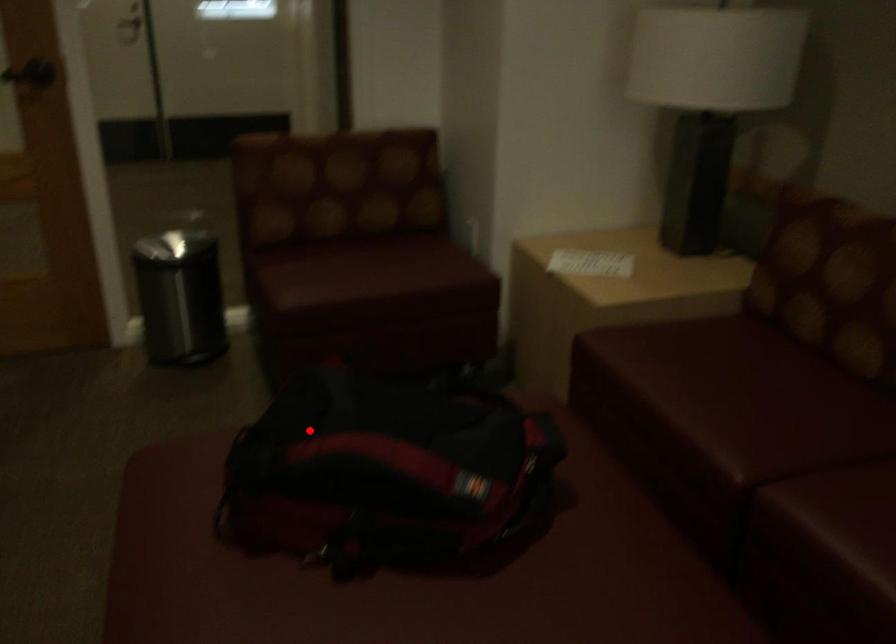
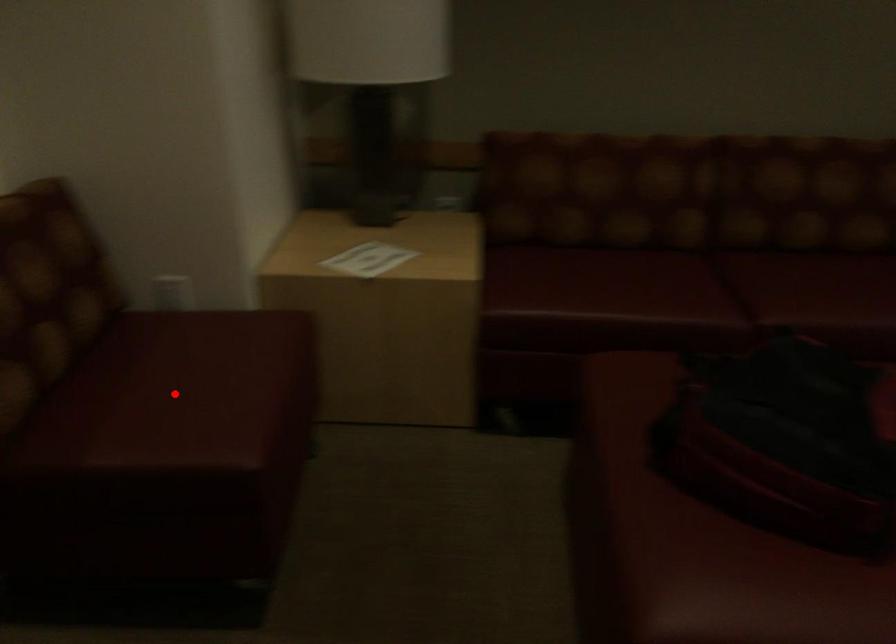
I am providing you with two images of the same scene from different viewpoints. A red point is marked on the first image and another point is marked on the second image. Are the points marked in image1 and image2 representing the same 3D position?

No